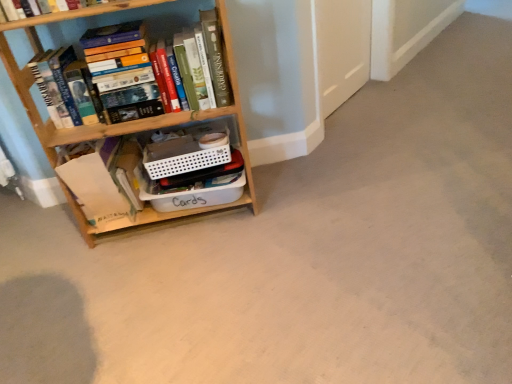
Question: From a real-world perspective, is wooden bookcase at left positioned over hardcover books at left, placed as the 2th book when sorted from bottom to top, based on gravity?

Choices:
 (A) yes
 (B) no

Answer: (B)

Question: Does wooden bookcase at left have a greater height compared to hardcover books at left, which appears as the 1th book when viewed from the top?

Choices:
 (A) no
 (B) yes

Answer: (B)

Question: From the image's perspective, is wooden bookcase at left above hardcover books at left, placed as the 2th book when sorted from bottom to top?

Choices:
 (A) yes
 (B) no

Answer: (B)

Question: Is wooden bookcase at left further to the viewer compared to hardcover books at left, placed as the 2th book when sorted from bottom to top?

Choices:
 (A) yes
 (B) no

Answer: (B)

Question: Is wooden bookcase at left looking in the opposite direction of hardcover books at left, which appears as the 1th book when viewed from the top?

Choices:
 (A) yes
 (B) no

Answer: (A)

Question: Is white plastic container at center wider or thinner than wooden bookcase at left?

Choices:
 (A) thin
 (B) wide

Answer: (A)

Question: In the image, is white plastic container at center positioned in front of or behind wooden bookcase at left?

Choices:
 (A) behind
 (B) front

Answer: (A)

Question: Considering the positions of white plastic container at center and wooden bookcase at left in the image, is white plastic container at center taller or shorter than wooden bookcase at left?

Choices:
 (A) short
 (B) tall

Answer: (A)

Question: From the image's perspective, is white plastic container at center located above or below wooden bookcase at left?

Choices:
 (A) above
 (B) below

Answer: (B)

Question: From the image's perspective, relative to white plastic container at center, is wooden bookcase at left above or below?

Choices:
 (A) above
 (B) below

Answer: (A)

Question: From a real-world perspective, is wooden bookcase at left above or below white plastic container at center?

Choices:
 (A) above
 (B) below

Answer: (A)

Question: Looking at the image, does wooden bookcase at left seem bigger or smaller compared to white plastic container at center?

Choices:
 (A) small
 (B) big

Answer: (B)

Question: Considering the positions of wooden bookcase at left and white plastic container at center in the image, is wooden bookcase at left wider or thinner than white plastic container at center?

Choices:
 (A) thin
 (B) wide

Answer: (B)

Question: Considering their positions, is white paper bag at lower left, the second book when ordered from top to bottom, located in front of or behind wooden bookcase at left?

Choices:
 (A) behind
 (B) front

Answer: (A)

Question: In terms of height, does white paper bag at lower left, the 1th book in the bottom-to-top sequence, look taller or shorter compared to wooden bookcase at left?

Choices:
 (A) tall
 (B) short

Answer: (B)